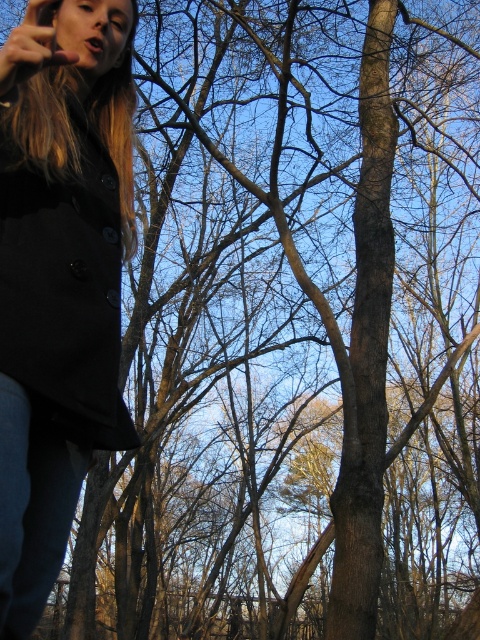
Can you confirm if black matte coat at left is taller than jeans at lower left?

Correct, black matte coat at left is much taller as jeans at lower left.

Consider the image. Does black matte coat at left have a lesser height compared to jeans at lower left?

Incorrect, black matte coat at left's height does not fall short of jeans at lower left's.

Locate an element on the screen. The height and width of the screenshot is (640, 480). black matte coat at left is located at coordinates (63, 280).